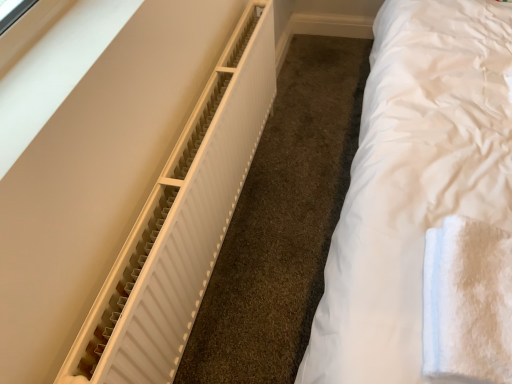
Find the location of `blank space situated above white matte radiator at left (from a real-world perspective)`. blank space situated above white matte radiator at left (from a real-world perspective) is located at coordinates (182, 149).